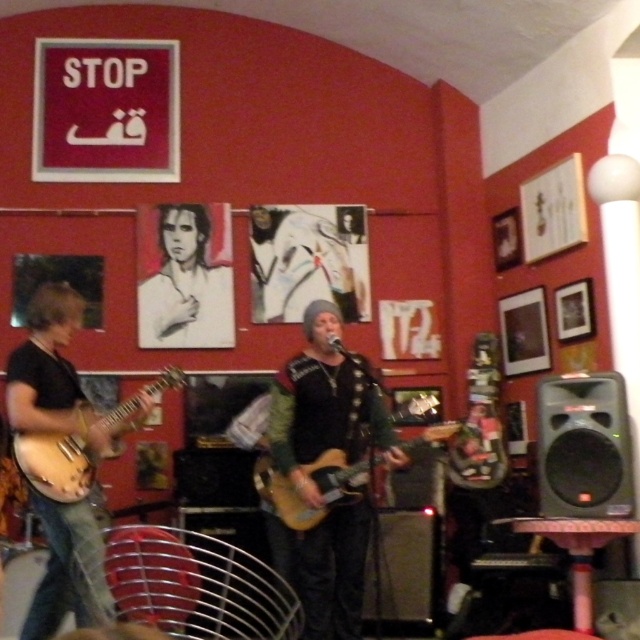
Question: From the image, what is the correct spatial relationship of black and white portrait at upper center in relation to wooden acoustic guitar at center?

Choices:
 (A) right
 (B) left

Answer: (B)

Question: Which of the following is the farthest from the observer?

Choices:
 (A) (20, 438)
 (B) (285, 525)
 (C) (380, 445)

Answer: (B)

Question: Does matte black guitar at center have a lesser width compared to wooden acoustic guitar at center?

Choices:
 (A) yes
 (B) no

Answer: (A)

Question: Which of the following is the farthest from the observer?

Choices:
 (A) matte black guitar at left
 (B) wooden acoustic guitar at center
 (C) matte black guitar at center
 (D) black and white portrait at upper center

Answer: (D)

Question: Which object is positioned farthest from the matte black guitar at center?

Choices:
 (A) matte black guitar at left
 (B) matte brown guitar at left

Answer: (A)

Question: Does matte black guitar at center come in front of matte black guitar at left?

Choices:
 (A) yes
 (B) no

Answer: (B)